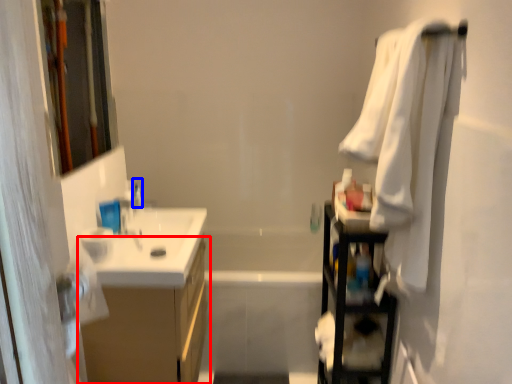
Question: Which of the following is the farthest to the observer, bathroom cabinet (highlighted by a red box) or toiletry (highlighted by a blue box)?

Choices:
 (A) bathroom cabinet
 (B) toiletry

Answer: (B)